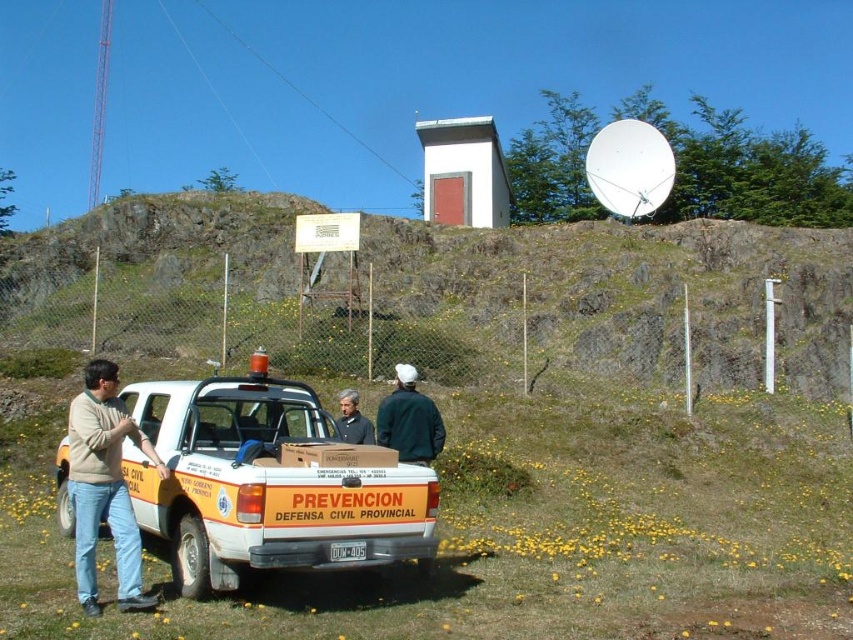
Can you confirm if light brown sweater at left is positioned below gray fabric jacket at center?

Actually, light brown sweater at left is above gray fabric jacket at center.

Is point (74, 500) farther from camera compared to point (344, 419)?

No, it is in front of (344, 419).

Locate an element on the screen. This screenshot has width=853, height=640. light brown sweater at left is located at coordinates (103, 486).

Is point (697, 340) farther from camera compared to point (335, 534)?

Yes.

Is rocky terrain at upper center positioned in front of white matte pickup truck at center?

That is False.

The image size is (853, 640). What are the coordinates of `rocky terrain at upper center` in the screenshot? It's located at (619, 296).

Does rocky terrain at upper center have a greater width compared to dark green fabric jacket at center?

Correct, the width of rocky terrain at upper center exceeds that of dark green fabric jacket at center.

Is point (131, 237) closer to camera compared to point (405, 438)?

No, (131, 237) is behind (405, 438).

In order to click on rocky terrain at upper center in this screenshot , I will do `click(619, 296)`.